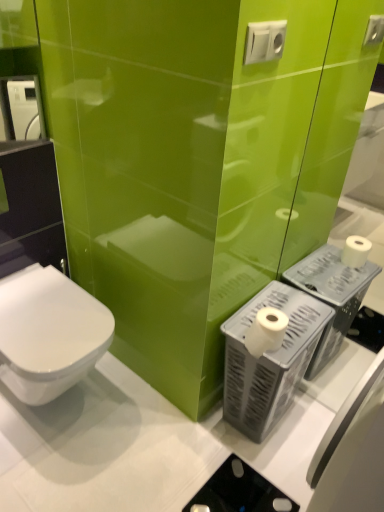
Question: In the image, is white glossy toilet at lower left positioned in front of or behind white matte toilet paper at right?

Choices:
 (A) behind
 (B) front

Answer: (B)

Question: Considering the positions of point (59, 352) and point (273, 339), is point (59, 352) closer or farther from the camera than point (273, 339)?

Choices:
 (A) closer
 (B) farther

Answer: (A)

Question: Which of these objects is positioned closest to the white plastic toilet paper holder at lower right?

Choices:
 (A) white glossy toilet at lower left
 (B) white plastic electric outlet at upper center
 (C) white matte toilet paper at right

Answer: (C)

Question: Which object is the closest to the white plastic toilet paper holder at lower right?

Choices:
 (A) white matte toilet paper at right
 (B) white glossy toilet at lower left
 (C) white plastic electric outlet at upper center

Answer: (A)